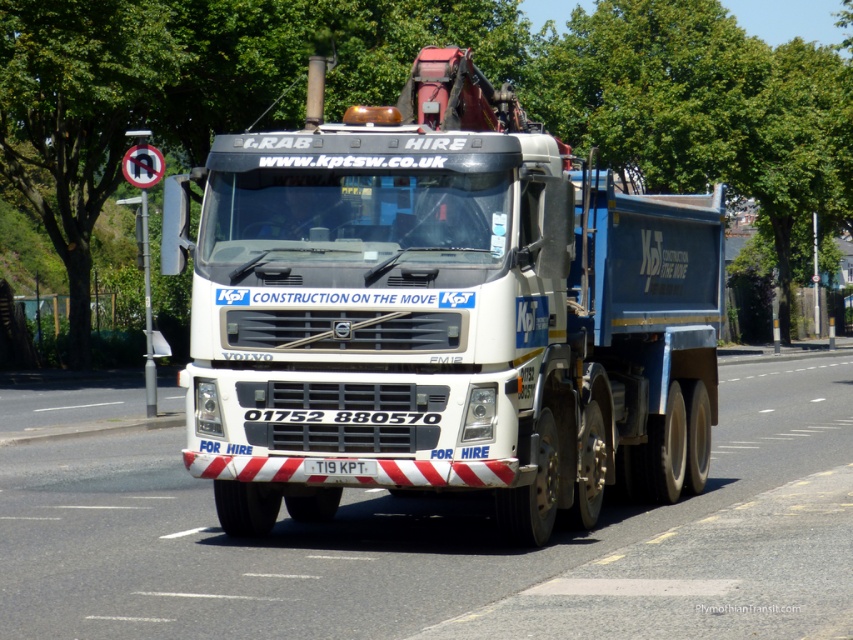
Does white metallic truck at center come behind white plastic license plate at center?

Yes, it is behind white plastic license plate at center.

How far apart are white metallic truck at center and white plastic license plate at center?

6.01 feet

What do you see at coordinates (442, 314) in the screenshot? I see `white metallic truck at center` at bounding box center [442, 314].

Where is `white metallic truck at center`? white metallic truck at center is located at coordinates click(442, 314).

Can you confirm if white metallic truck at center is smaller than green leafy tree at upper left?

Indeed, white metallic truck at center has a smaller size compared to green leafy tree at upper left.

Does white metallic truck at center have a lesser height compared to green leafy tree at upper left?

Indeed, white metallic truck at center has a lesser height compared to green leafy tree at upper left.

Which is in front, point (590, 442) or point (148, 49)?

Positioned in front is point (590, 442).

At what (x,y) coordinates should I click in order to perform the action: click on white metallic truck at center. Please return your answer as a coordinate pair (x, y). This screenshot has height=640, width=853. Looking at the image, I should click on (442, 314).

Measure the distance between green leafy tree at upper center and camera.

green leafy tree at upper center and camera are 31.59 meters apart from each other.

Is point (782, 220) farther from camera compared to point (71, 298)?

Yes, point (782, 220) is farther from viewer.

What are the coordinates of `green leafy tree at upper center` in the screenshot? It's located at (401, 88).